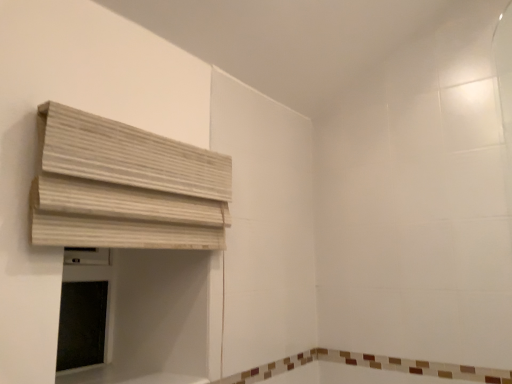
Measure the distance between brown tile bath at lower right and camera.

brown tile bath at lower right is 1.31 meters from camera.

The image size is (512, 384). Find the location of `brown tile bath at lower right`. brown tile bath at lower right is located at coordinates (370, 367).

This screenshot has height=384, width=512. What do you see at coordinates (370, 367) in the screenshot?
I see `brown tile bath at lower right` at bounding box center [370, 367].

You are a GUI agent. You are given a task and a screenshot of the screen. Output one action in this format:
    pyautogui.click(x=<x>, y=<y>)
    Task: Click on the beige wood blinds at upper left
    The image size is (512, 384).
    Given the screenshot: What is the action you would take?
    pyautogui.click(x=125, y=186)

What is the approximate height of beige wood blinds at upper left?

It is 13.22 inches.

What is the approximate width of beige wood blinds at upper left?

It is 3.06 inches.

What do you see at coordinates (125, 186) in the screenshot? This screenshot has width=512, height=384. I see `beige wood blinds at upper left` at bounding box center [125, 186].

Locate an element on the screen. The image size is (512, 384). brown tile bath at lower right is located at coordinates (370, 367).

Between beige wood blinds at upper left and brown tile bath at lower right, which one appears on the right side from the viewer's perspective?

From the viewer's perspective, brown tile bath at lower right appears more on the right side.

Between beige wood blinds at upper left and brown tile bath at lower right, which one is positioned behind?

brown tile bath at lower right is behind.

Is point (223, 235) less distant than point (510, 381)?

Yes.

From the image's perspective, between beige wood blinds at upper left and brown tile bath at lower right, which one is located above?

From the image's view, beige wood blinds at upper left is above.

From a real-world perspective, is beige wood blinds at upper left physically below brown tile bath at lower right?

→ No, from a real-world perspective, beige wood blinds at upper left is not beneath brown tile bath at lower right.

Which of these two, beige wood blinds at upper left or brown tile bath at lower right, is thinner?

Thinner between the two is brown tile bath at lower right.

Consider the image. From their relative heights in the image, would you say beige wood blinds at upper left is taller or shorter than brown tile bath at lower right?

Considering their sizes, beige wood blinds at upper left has more height than brown tile bath at lower right.

Which of these two, beige wood blinds at upper left or brown tile bath at lower right, is bigger?

beige wood blinds at upper left.

Is brown tile bath at lower right inside beige wood blinds at upper left?

No, beige wood blinds at upper left does not contain brown tile bath at lower right.

In the scene shown: Is beige wood blinds at upper left next to brown tile bath at lower right?

There is a gap between beige wood blinds at upper left and brown tile bath at lower right.

Is beige wood blinds at upper left oriented away from brown tile bath at lower right?

No, beige wood blinds at upper left is not facing away from brown tile bath at lower right.

Can you tell me how much beige wood blinds at upper left and brown tile bath at lower right differ in facing direction?

The angular difference between beige wood blinds at upper left and brown tile bath at lower right is 84.3 degrees.

Where is `curtain located on the left of brown tile bath at lower right`? This screenshot has height=384, width=512. curtain located on the left of brown tile bath at lower right is located at coordinates tap(125, 186).

Based on their positions, is brown tile bath at lower right located to the left or right of beige wood blinds at upper left?

brown tile bath at lower right is positioned on beige wood blinds at upper left's right side.

Is brown tile bath at lower right positioned behind beige wood blinds at upper left?

Yes, it is.

Which point is more forward, (266, 365) or (190, 158)?

Positioned in front is point (190, 158).

From the image's perspective, would you say brown tile bath at lower right is shown under beige wood blinds at upper left?

Yes, from the image's perspective, brown tile bath at lower right is below beige wood blinds at upper left.

From a real-world perspective, is brown tile bath at lower right below beige wood blinds at upper left?

Correct, in the physical world, brown tile bath at lower right is lower than beige wood blinds at upper left.

Does brown tile bath at lower right have a lesser width compared to beige wood blinds at upper left?

Yes, brown tile bath at lower right is thinner than beige wood blinds at upper left.

Between brown tile bath at lower right and beige wood blinds at upper left, which one has less height?

brown tile bath at lower right.

Does brown tile bath at lower right have a larger size compared to beige wood blinds at upper left?

Actually, brown tile bath at lower right might be smaller than beige wood blinds at upper left.

Is brown tile bath at lower right not inside beige wood blinds at upper left?

Yes, brown tile bath at lower right is located beyond the bounds of beige wood blinds at upper left.

Is brown tile bath at lower right beside beige wood blinds at upper left?

brown tile bath at lower right and beige wood blinds at upper left are not in contact.

Is brown tile bath at lower right looking in the opposite direction of beige wood blinds at upper left?

That's not correct — brown tile bath at lower right is not looking away from beige wood blinds at upper left.

In the image, there is a beige wood blinds at upper left. Where is `bath below it (from a real-world perspective)`? This screenshot has height=384, width=512. bath below it (from a real-world perspective) is located at coordinates (370, 367).

Where is `bath located below the beige wood blinds at upper left (from the image's perspective)`? This screenshot has height=384, width=512. bath located below the beige wood blinds at upper left (from the image's perspective) is located at coordinates (370, 367).

I want to click on curtain above the brown tile bath at lower right (from a real-world perspective), so click(125, 186).